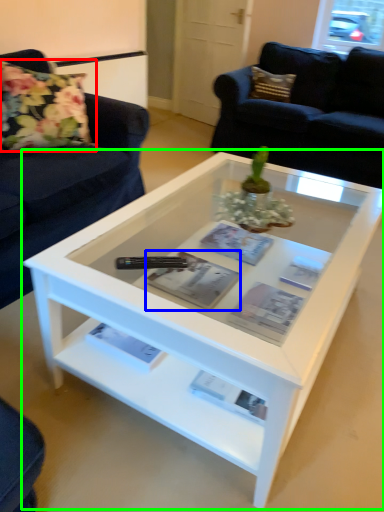
Question: Which is nearer to the flower (highlighted by a red box)? magazine (highlighted by a blue box) or coffee table (highlighted by a green box).

Choices:
 (A) magazine
 (B) coffee table

Answer: (B)